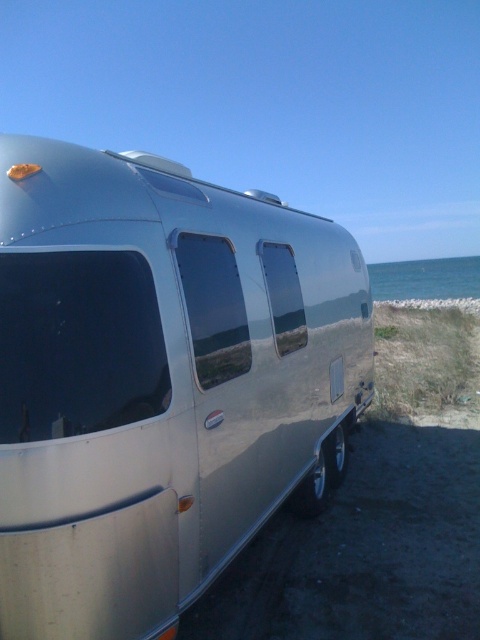
Who is higher up, silver metallic trailer at center or blue water at right?

blue water at right

Does silver metallic trailer at center have a lesser width compared to blue water at right?

Yes, silver metallic trailer at center is thinner than blue water at right.

Is point (97, 237) farther from camera compared to point (446, 273)?

No.

Locate an element on the screen. silver metallic trailer at center is located at coordinates (158, 381).